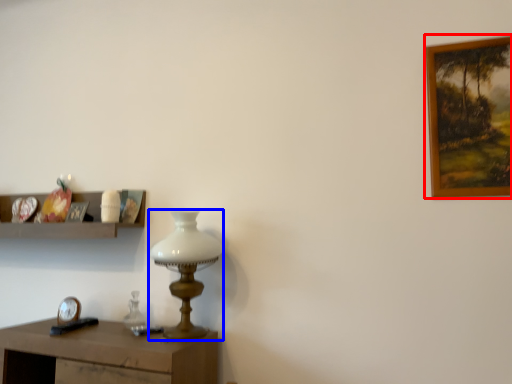
Question: Which object is closer to the camera taking this photo, picture frame (highlighted by a red box) or table lamp (highlighted by a blue box)?

Choices:
 (A) picture frame
 (B) table lamp

Answer: (A)